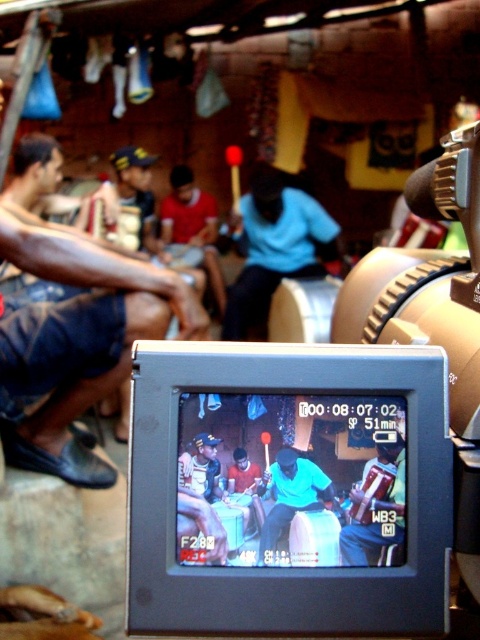
How distant is dark blue denim shorts at left from matte blue shirt at center?

dark blue denim shorts at left is 1.67 meters from matte blue shirt at center.

Between dark blue denim shorts at left and matte blue shirt at center, which one appears on the left side from the viewer's perspective?

dark blue denim shorts at left is more to the left.

Is point (40, 388) less distant than point (382, 516)?

No, it is behind (382, 516).

The height and width of the screenshot is (640, 480). Identify the location of dark blue denim shorts at left. (74, 339).

Measure the distance between point (350, 518) and camera.

A distance of 20.76 inches exists between point (350, 518) and camera.

Is matte blue shirt at center shorter than blue fabric at center?

No.

Who is more distant from viewer, (392, 474) or (309, 484)?

The point (392, 474) is behind.

Identify the location of matte blue shirt at center. The width and height of the screenshot is (480, 640). (377, 506).

Does blue matte shirt at center appear on the right side of matte blue shirt at center?

Correct, you'll find blue matte shirt at center to the right of matte blue shirt at center.

Between blue matte shirt at center and matte blue shirt at center, which one appears on the left side from the viewer's perspective?

Positioned to the left is matte blue shirt at center.

Is point (288, 221) less distant than point (352, 506)?

No, (288, 221) is further to viewer.

Where is `blue matte shirt at center`? This screenshot has height=640, width=480. blue matte shirt at center is located at coordinates (275, 248).